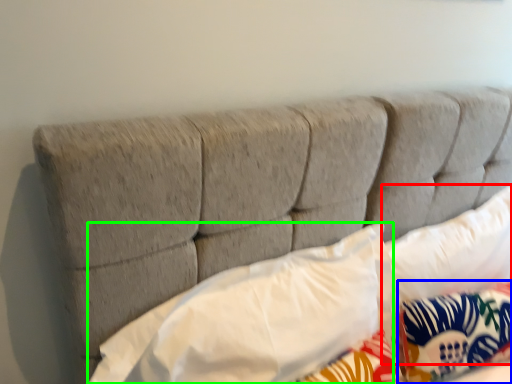
Question: Which is farther away from pillow (highlighted by a red box)? pillow (highlighted by a blue box) or pillow (highlighted by a green box)?

Choices:
 (A) pillow
 (B) pillow

Answer: (B)